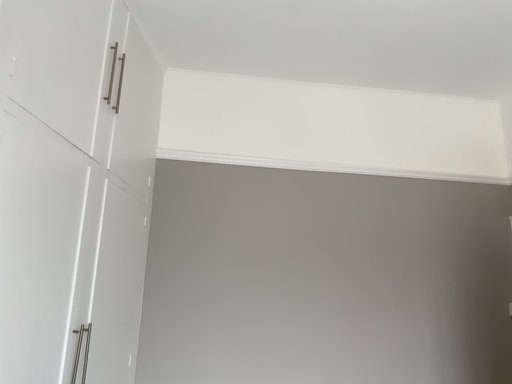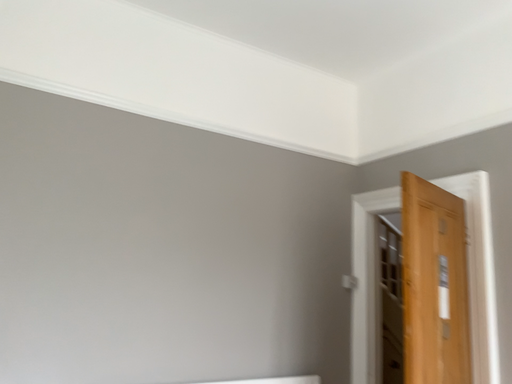
Question: How did the camera likely rotate when shooting the video?

Choices:
 (A) rotated left
 (B) rotated right

Answer: (B)